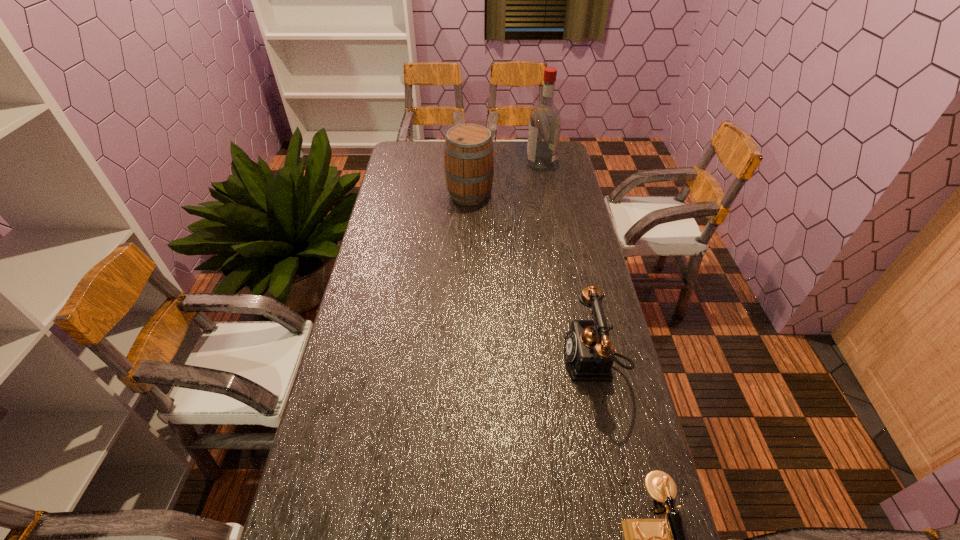
The height and width of the screenshot is (540, 960). I want to click on vacant space situated 0.240m on the front of the second nearest object at the rotary dial, so click(x=481, y=360).

Image resolution: width=960 pixels, height=540 pixels. What are the coordinates of `vacant space positioned 0.120m on the front of the second nearest object at the rotary dial` in the screenshot? It's located at (522, 360).

At what (x,y) coordinates should I click in order to perform the action: click on object that is positioned at the far edge. Please return your answer as a coordinate pair (x, y). The width and height of the screenshot is (960, 540). Looking at the image, I should click on (545, 121).

Identify the location of liquor that is at the right edge. (545, 121).

Where is `telephone that is at the right edge`? telephone that is at the right edge is located at coordinates (590, 354).

The width and height of the screenshot is (960, 540). Find the location of `object that is at the far right corner`. object that is at the far right corner is located at coordinates (545, 121).

The width and height of the screenshot is (960, 540). In the image, there is a desktop. Identify the location of vacant space at the left edge. (374, 220).

You are a GUI agent. You are given a task and a screenshot of the screen. Output one action in this format:
    pyautogui.click(x=<x>, y=<y>)
    Task: Click on the blank space at the right edge
    This screenshot has height=540, width=960.
    Given the screenshot: What is the action you would take?
    pyautogui.click(x=619, y=453)

At what (x,y) coordinates should I click in order to perform the action: click on vacant area that lies between the liquor and the second tallest object. Please return your answer as a coordinate pair (x, y). The image size is (960, 540). Looking at the image, I should click on (505, 178).

Find the location of a particular element. This screenshot has width=960, height=540. free area in between the second farthest object and the farther telephone is located at coordinates (531, 277).